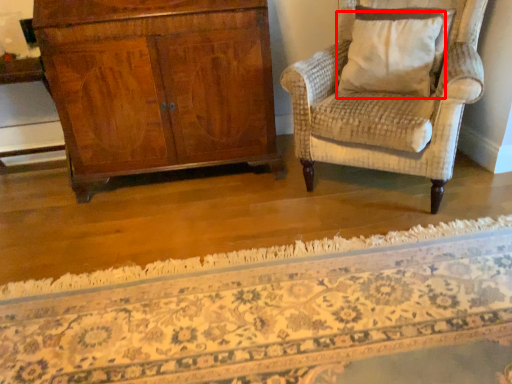
Question: From the image, what is the correct spatial relationship of pillow (annotated by the red box) in relation to mat?

Choices:
 (A) left
 (B) right

Answer: (B)